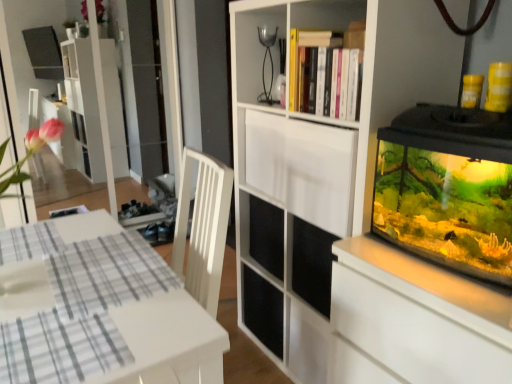
Question: Does point (350, 152) appear closer or farther from the camera than point (367, 195)?

Choices:
 (A) farther
 (B) closer

Answer: (B)

Question: Relative to white matte cupboard at center, is white matte cabinet at upper center in front or behind?

Choices:
 (A) behind
 (B) front

Answer: (A)

Question: Considering the real-world distances, which object is closest to the white matte cabinet at upper center?

Choices:
 (A) white matte cupboard at center
 (B) white glossy table at lower left

Answer: (A)

Question: Which object is the farthest from the white matte cabinet at upper center?

Choices:
 (A) white matte cupboard at center
 (B) white glossy table at lower left

Answer: (B)